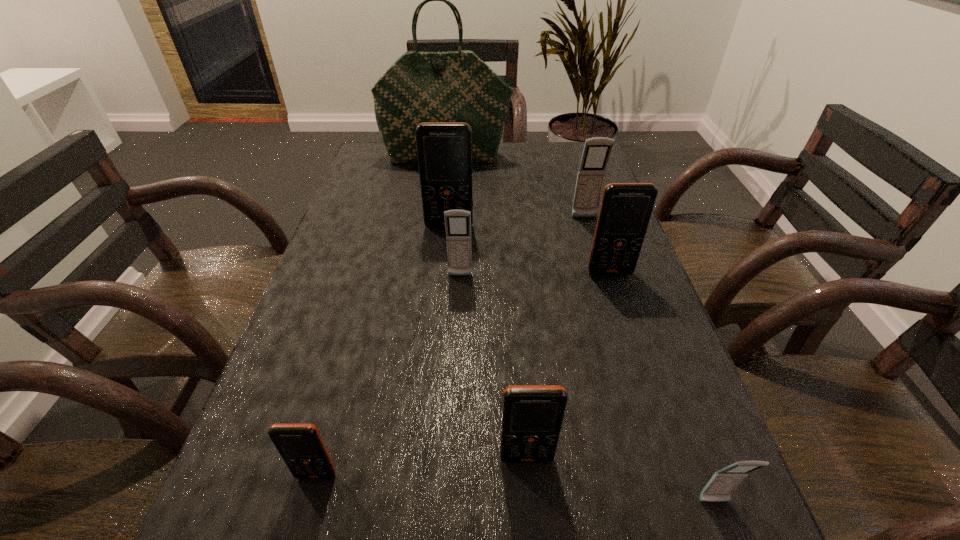
The height and width of the screenshot is (540, 960). Find the location of `green tote bag`. green tote bag is located at coordinates (457, 86).

Where is `tote bag`? tote bag is located at coordinates (457, 86).

Find the location of a particular element. The height and width of the screenshot is (540, 960). the biggest orange cellular telephone is located at coordinates (444, 149).

Identify the location of the second farthest cellular telephone. (444, 149).

Locate an element on the screen. The width and height of the screenshot is (960, 540). the farthest gray cellular telephone is located at coordinates 597,150.

Find the location of a particular element. the farthest cellular telephone is located at coordinates (597, 150).

This screenshot has width=960, height=540. I want to click on the rightmost orange cellular telephone, so click(626, 208).

The width and height of the screenshot is (960, 540). Identify the location of the second biggest orange cellular telephone. (626, 208).

You are a GUI agent. You are given a task and a screenshot of the screen. Output one action in this format:
    pyautogui.click(x=<x>, y=<y>)
    Task: Click on the second biggest gray cellular telephone
    
    Given the screenshot: What is the action you would take?
    pyautogui.click(x=457, y=222)

The width and height of the screenshot is (960, 540). What are the coordinates of `the second farthest gray cellular telephone` in the screenshot? It's located at (457, 222).